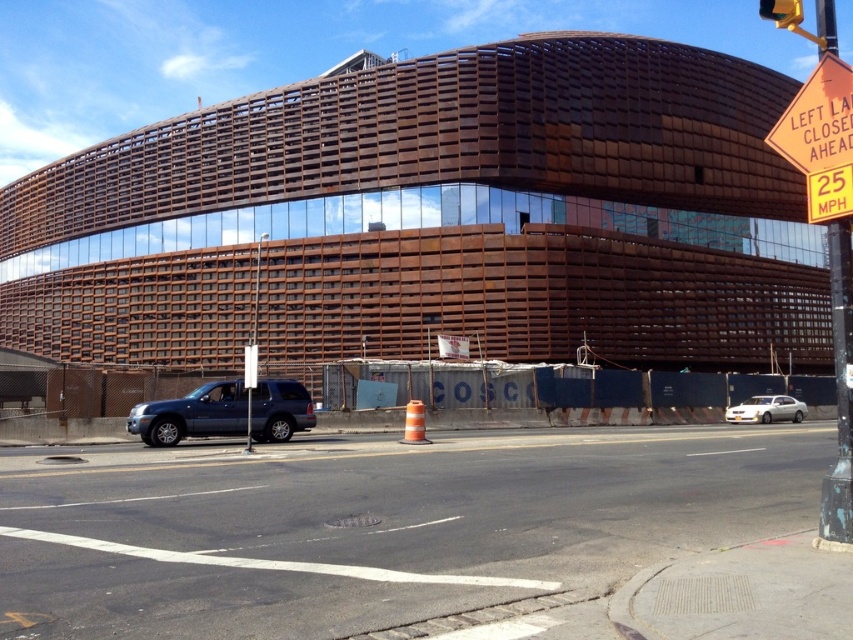
Where is `black asphalt at lower center`? Image resolution: width=853 pixels, height=640 pixels. black asphalt at lower center is located at coordinates (374, 525).

Between point (231, 563) and point (817, 100), which one is positioned behind?

The point (231, 563) is more distant.

Can you confirm if black asphalt at lower center is thinner than orange reflective plastic sign at upper right?

Indeed, black asphalt at lower center has a lesser width compared to orange reflective plastic sign at upper right.

Is point (194, 481) less distant than point (845, 132)?

No, (194, 481) is behind (845, 132).

Identify the location of black asphalt at lower center. (374, 525).

Can you confirm if black asphalt at lower center is taller than white glossy sedan at lower right?

Yes, black asphalt at lower center is taller than white glossy sedan at lower right.

Who is positioned more to the right, black asphalt at lower center or white glossy sedan at lower right?

Positioned to the right is white glossy sedan at lower right.

Who is more distant from viewer, (234, 593) or (804, 404)?

Positioned behind is point (804, 404).

Find the location of `black asphalt at lower center`. black asphalt at lower center is located at coordinates (374, 525).